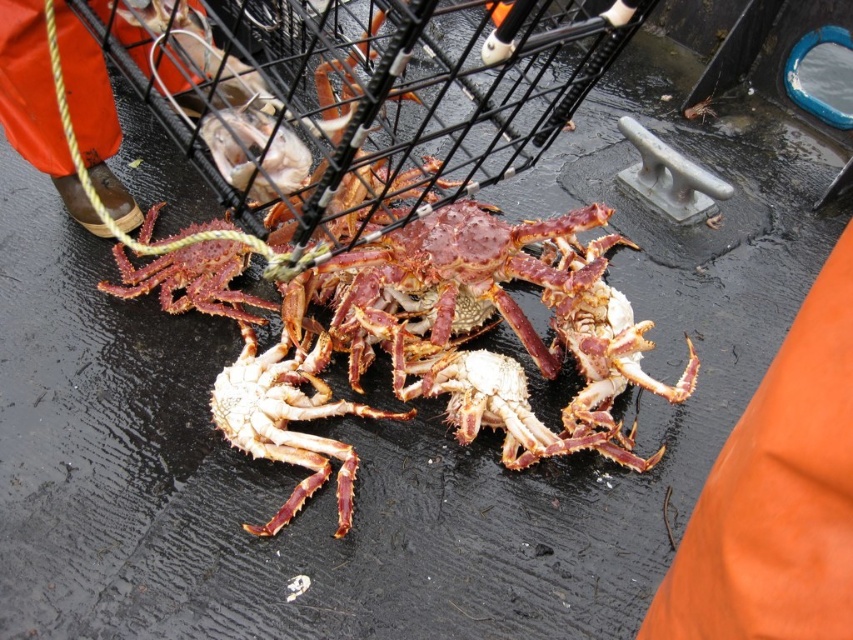
Locate an element on the screen. shiny red crab at center is located at coordinates (287, 420).

Which is below, shiny red crab at center or shiny reddish-brown crab at center?

shiny red crab at center is below.

Is point (314, 348) positioned before point (204, 307)?

Yes, point (314, 348) is in front of point (204, 307).

The image size is (853, 640). I want to click on shiny red crab at center, so click(x=287, y=420).